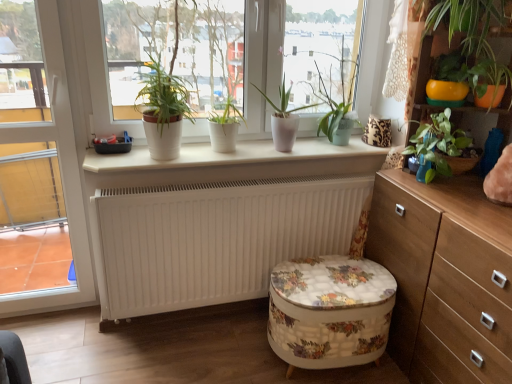
This screenshot has height=384, width=512. Identify the location of vacant point to the left of floral fabric ottoman at center. (230, 354).